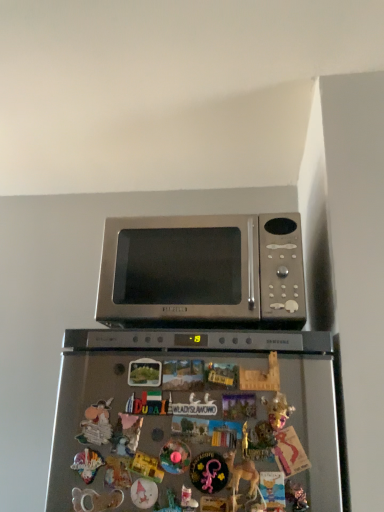
Question: Is satin silver microwave at upper center surrounding gold metallic mask at upper center?

Choices:
 (A) yes
 (B) no

Answer: (B)

Question: From a real-world perspective, is satin silver microwave at upper center on top of gold metallic mask at upper center?

Choices:
 (A) no
 (B) yes

Answer: (B)

Question: Considering the relative sizes of satin silver microwave at upper center and gold metallic mask at upper center in the image provided, is satin silver microwave at upper center shorter than gold metallic mask at upper center?

Choices:
 (A) yes
 (B) no

Answer: (B)

Question: Considering the relative positions of satin silver microwave at upper center and gold metallic mask at upper center in the image provided, is satin silver microwave at upper center in front of gold metallic mask at upper center?

Choices:
 (A) no
 (B) yes

Answer: (A)

Question: Can you confirm if satin silver microwave at upper center is positioned to the right of gold metallic mask at upper center?

Choices:
 (A) yes
 (B) no

Answer: (B)

Question: Can you confirm if satin silver microwave at upper center is positioned to the left of gold metallic mask at upper center?

Choices:
 (A) yes
 (B) no

Answer: (A)

Question: From the image's perspective, is gold metallic mask at upper center under satin silver microwave at upper center?

Choices:
 (A) no
 (B) yes

Answer: (B)

Question: Is gold metallic mask at upper center positioned in front of satin silver microwave at upper center?

Choices:
 (A) yes
 (B) no

Answer: (A)

Question: Is gold metallic mask at upper center behind satin silver microwave at upper center?

Choices:
 (A) no
 (B) yes

Answer: (A)

Question: Does gold metallic mask at upper center have a larger size compared to satin silver microwave at upper center?

Choices:
 (A) no
 (B) yes

Answer: (A)

Question: Can you confirm if gold metallic mask at upper center is shorter than satin silver microwave at upper center?

Choices:
 (A) yes
 (B) no

Answer: (A)

Question: Does gold metallic mask at upper center have a lesser width compared to satin silver microwave at upper center?

Choices:
 (A) yes
 (B) no

Answer: (A)

Question: From a real-world perspective, is gold metallic mask at upper center above or below satin silver microwave at upper center?

Choices:
 (A) below
 (B) above

Answer: (A)